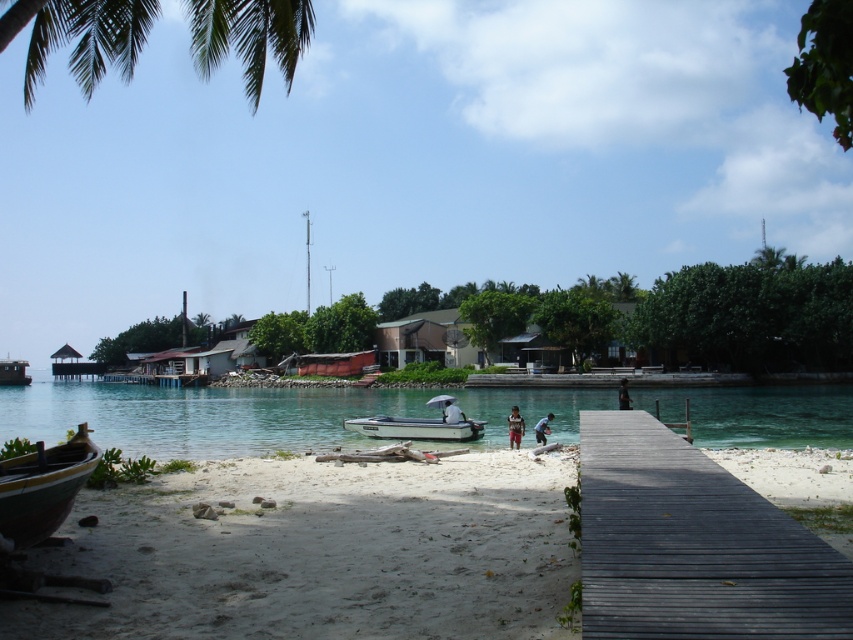
The height and width of the screenshot is (640, 853). Describe the element at coordinates (263, 413) in the screenshot. I see `clear blue water at center` at that location.

Based on the photo, is clear blue water at center to the left of blue fabric shirt at center from the viewer's perspective?

Indeed, clear blue water at center is positioned on the left side of blue fabric shirt at center.

Between point (527, 440) and point (544, 417), which one is positioned in front?

Point (527, 440) is in front.

Find the location of a particular element. clear blue water at center is located at coordinates (263, 413).

Can you confirm if dark gray wood dock at lower right is thinner than blue fabric shirt at center?

No.

Is dark gray wood dock at lower right further to camera compared to blue fabric shirt at center?

No, dark gray wood dock at lower right is closer to the viewer.

Describe the element at coordinates (693, 545) in the screenshot. This screenshot has height=640, width=853. I see `dark gray wood dock at lower right` at that location.

Identify the location of dark gray wood dock at lower right. (693, 545).

Who is more distant from viewer, (364, 433) or (628, 396)?

Point (628, 396)

What do you see at coordinates (419, 426) in the screenshot?
I see `white plastic boat at center` at bounding box center [419, 426].

Where is `white plastic boat at center`? This screenshot has height=640, width=853. white plastic boat at center is located at coordinates (419, 426).